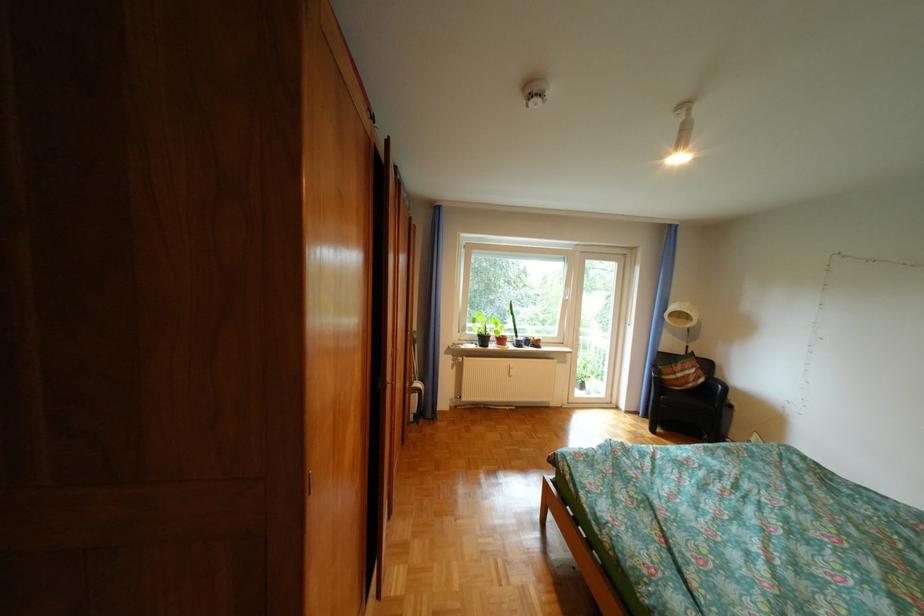
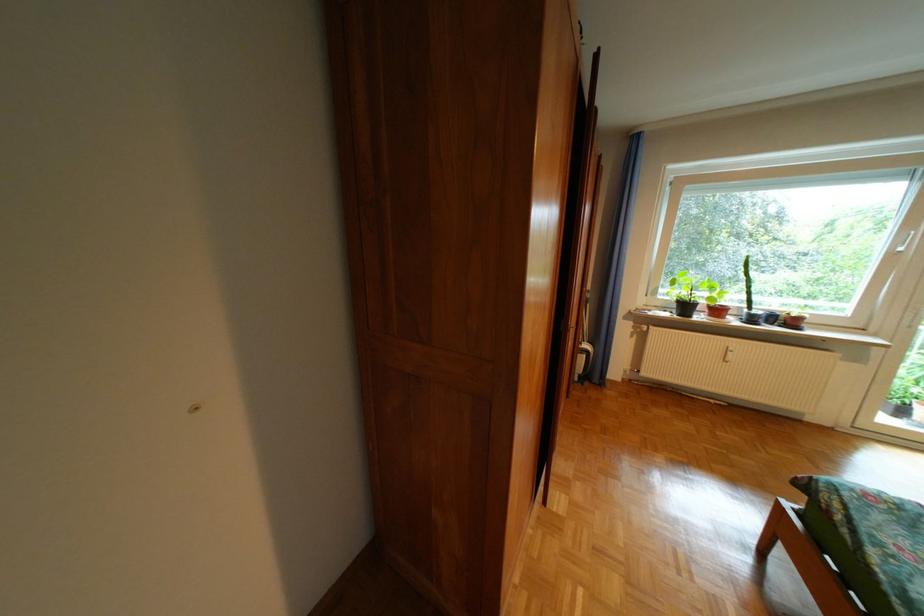
Where in the second image is the point corresponding to pixel 487 347 from the first image?

(679, 315)